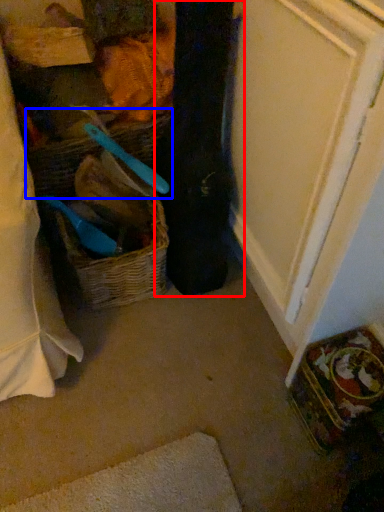
Question: Which object appears farthest to the camera in this image, clothing (highlighted by a red box) or basket (highlighted by a blue box)?

Choices:
 (A) clothing
 (B) basket

Answer: (B)